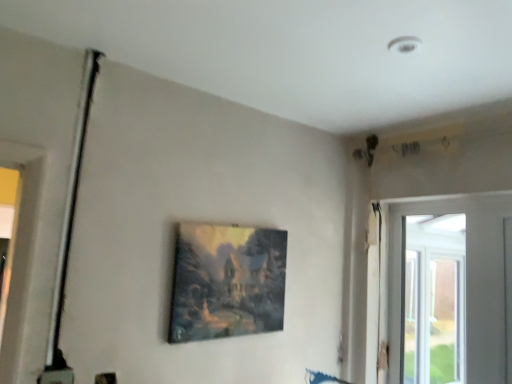
You are a GUI agent. You are given a task and a screenshot of the screen. Output one action in this format:
    pyautogui.click(x=<x>, y=<y>)
    Task: Click on the transparent glass window at right
    
    Given the screenshot: What is the action you would take?
    pyautogui.click(x=434, y=299)

This screenshot has height=384, width=512. What do you see at coordinates (434, 299) in the screenshot?
I see `transparent glass window at right` at bounding box center [434, 299].

What do you see at coordinates (227, 282) in the screenshot? I see `matte wooden picture frame at center` at bounding box center [227, 282].

Measure the distance between point (245,304) and camera.

Point (245,304) and camera are 1.62 meters apart from each other.

I want to click on matte wooden picture frame at center, so click(227, 282).

Find the location of `transparent glass window at right`. transparent glass window at right is located at coordinates (434, 299).

Which object is positioned more to the right, matte wooden picture frame at center or transparent glass window at right?

From the viewer's perspective, transparent glass window at right appears more on the right side.

Which object is further away from the camera, matte wooden picture frame at center or transparent glass window at right?

transparent glass window at right is behind.

Which is further, (190,279) or (451,320)?

Point (451,320)

From the image's perspective, is matte wooden picture frame at center above or below transparent glass window at right?

matte wooden picture frame at center is above transparent glass window at right.

From a real-world perspective, between matte wooden picture frame at center and transparent glass window at right, who is vertically lower?

transparent glass window at right, from a real-world perspective.

Which object is wider, matte wooden picture frame at center or transparent glass window at right?

matte wooden picture frame at center is wider.

Who is shorter, matte wooden picture frame at center or transparent glass window at right?

Standing shorter between the two is matte wooden picture frame at center.

Which of these two, matte wooden picture frame at center or transparent glass window at right, is smaller?

matte wooden picture frame at center is smaller.

Is matte wooden picture frame at center outside of transparent glass window at right?

Indeed, matte wooden picture frame at center is completely outside transparent glass window at right.

In the scene shown: Are matte wooden picture frame at center and transparent glass window at right beside each other?

matte wooden picture frame at center is not next to transparent glass window at right, and they're not touching.

Could you tell me if matte wooden picture frame at center is turned towards transparent glass window at right?

No, matte wooden picture frame at center is not aimed at transparent glass window at right.

Locate an element on the screen. Image resolution: width=512 pixels, height=384 pixels. window below the matte wooden picture frame at center (from the image's perspective) is located at coordinates (434, 299).

Which is more to the left, transparent glass window at right or matte wooden picture frame at center?

matte wooden picture frame at center.

Is transparent glass window at right behind matte wooden picture frame at center?

Yes, transparent glass window at right is further from the camera.

Does point (452, 370) lie behind point (233, 283)?

Yes.

From the image's perspective, which object appears higher, transparent glass window at right or matte wooden picture frame at center?

From the image's view, matte wooden picture frame at center is above.

From a real-world perspective, is transparent glass window at right physically above matte wooden picture frame at center?

No.

Can you confirm if transparent glass window at right is wider than matte wooden picture frame at center?

No, transparent glass window at right is not wider than matte wooden picture frame at center.

Who is taller, transparent glass window at right or matte wooden picture frame at center?

transparent glass window at right is taller.

Considering the sizes of objects transparent glass window at right and matte wooden picture frame at center in the image provided, who is smaller, transparent glass window at right or matte wooden picture frame at center?

matte wooden picture frame at center.

Is matte wooden picture frame at center located within transparent glass window at right?

Actually, matte wooden picture frame at center is outside transparent glass window at right.

Is transparent glass window at right next to matte wooden picture frame at center and touching it?

transparent glass window at right and matte wooden picture frame at center are clearly separated.

Could you tell me if transparent glass window at right is turned towards matte wooden picture frame at center?

Yes, transparent glass window at right faces towards matte wooden picture frame at center.

Locate an element on the screen. This screenshot has width=512, height=384. window on the right of matte wooden picture frame at center is located at coordinates (434, 299).

This screenshot has height=384, width=512. In order to click on window that is on the right side of matte wooden picture frame at center in this screenshot , I will do `click(434, 299)`.

Where is `picture frame above the transparent glass window at right (from a real-world perspective)`? The width and height of the screenshot is (512, 384). picture frame above the transparent glass window at right (from a real-world perspective) is located at coordinates (227, 282).